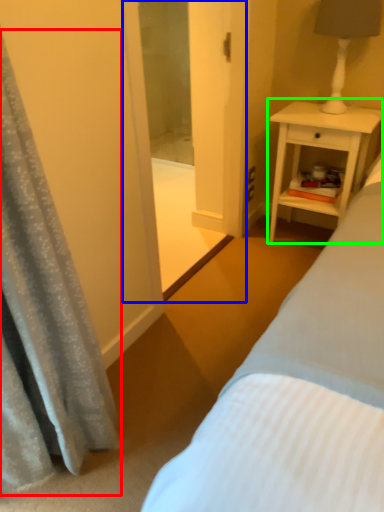
Question: Considering the real-world distances, which object is closest to curtain (highlighted by a red box)? screen door (highlighted by a blue box) or nightstand (highlighted by a green box).

Choices:
 (A) screen door
 (B) nightstand

Answer: (A)